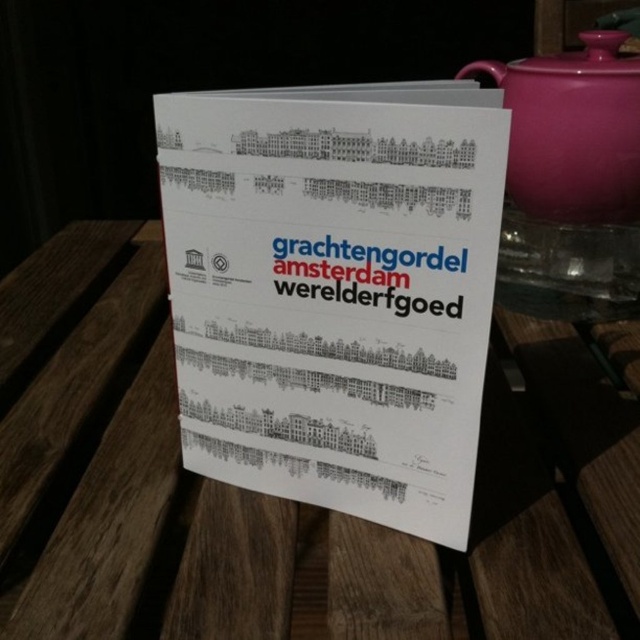
You are at a tourist information desk in Amsterdam and see the white paper sign at center and the matte pink ceramic teapot at upper right. Which object is wider?

→ The white paper sign at center might be wider than matte pink ceramic teapot at upper right.

You are standing at the point with coordinates (284, 499) in the image. What object are you standing on?

You are standing on the wooden picnic table at center, which is located at point (284, 499).

From the picture: You are at a tourist information desk in Amsterdam and need to place a 6.5 inch wide souvenir on the table. There is a white paper sign at center and a matte pink ceramic teapot at upper right. Can the souvenir fit between them?

The distance between the white paper sign at center and the matte pink ceramic teapot at upper right is 6.76 inches. Since the souvenir is 6.5 inches wide, it can fit between them as the space is slightly larger than the souvenir.